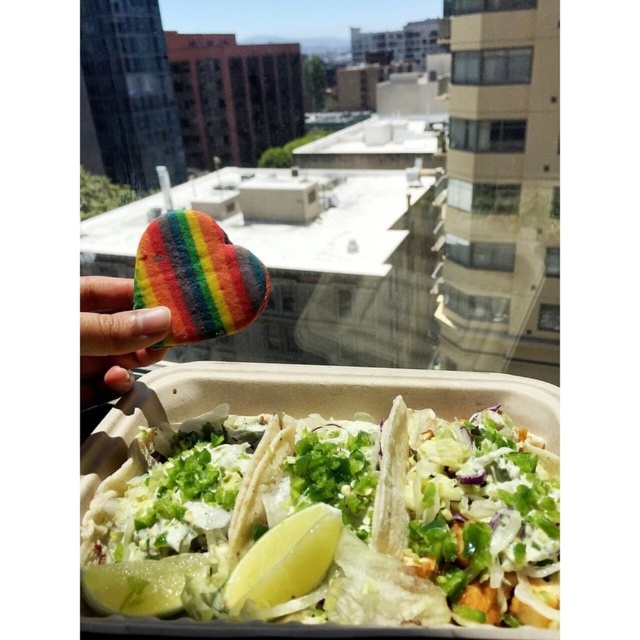
You are a food delivery person who needs to pack the white paper taco at center and the yellow matte lemon at lower center into a small container. The container can only fit items that are smaller than 10 cm in size. Based on the scene description, can both items fit?

The white paper taco at center is bigger than the yellow matte lemon at lower center. However, since the lemon is at lower center and the taco is at center, their sizes relative to 10 cm are not specified. Without knowing their exact sizes, it is impossible to determine if both items will fit in the container.

You are standing on a balcony and see a heart shaped cookie and a takeout container with food. Which object is closer to the center of the scene, the green leafy lettuce at center or the heart shaped cookie?

The green leafy lettuce at center is located at point (x=196, y=522), which is closer to the center of the scene compared to the heart shaped cookie.